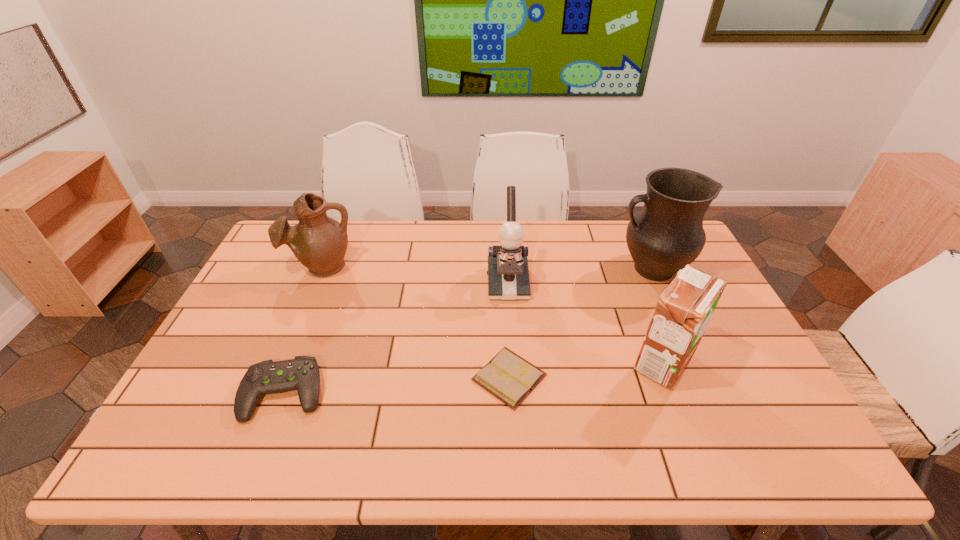
Locate an element on the screen. The image size is (960, 540). microscope is located at coordinates (508, 274).

Find the location of a particular element. The width and height of the screenshot is (960, 540). the right pitcher is located at coordinates (667, 234).

Locate an element on the screen. Image resolution: width=960 pixels, height=540 pixels. the left pitcher is located at coordinates (319, 242).

Identify the location of carton. (684, 309).

Find the location of a particular element. The height and width of the screenshot is (540, 960). control is located at coordinates (302, 373).

This screenshot has height=540, width=960. What are the coordinates of `diary` in the screenshot? It's located at tap(510, 378).

Identify the location of blank space located 0.400m at the eyepiece of the microscope. This screenshot has height=540, width=960. (516, 418).

Where is `free space located 0.260m on the handle side of the right pitcher`? This screenshot has width=960, height=540. free space located 0.260m on the handle side of the right pitcher is located at coordinates (536, 269).

Locate an element on the screen. The image size is (960, 540). vacant space located 0.240m on the handle side of the right pitcher is located at coordinates (541, 269).

This screenshot has width=960, height=540. Find the location of `vacant space located on the handle side of the right pitcher`. vacant space located on the handle side of the right pitcher is located at coordinates pyautogui.click(x=581, y=269).